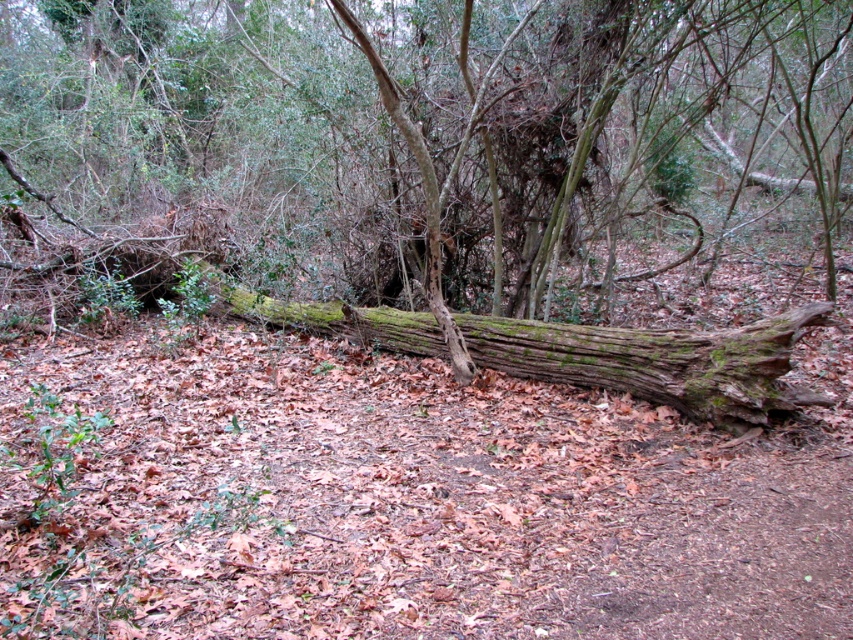
Question: Which object appears closest to the camera in this image?

Choices:
 (A) green mossy log at center
 (B) green mossy wood at center

Answer: (B)

Question: Does green mossy log at center appear on the right side of green mossy wood at center?

Choices:
 (A) yes
 (B) no

Answer: (B)

Question: In this image, where is green mossy log at center located relative to green mossy wood at center?

Choices:
 (A) above
 (B) below

Answer: (A)

Question: Is green mossy log at center behind green mossy wood at center?

Choices:
 (A) no
 (B) yes

Answer: (B)